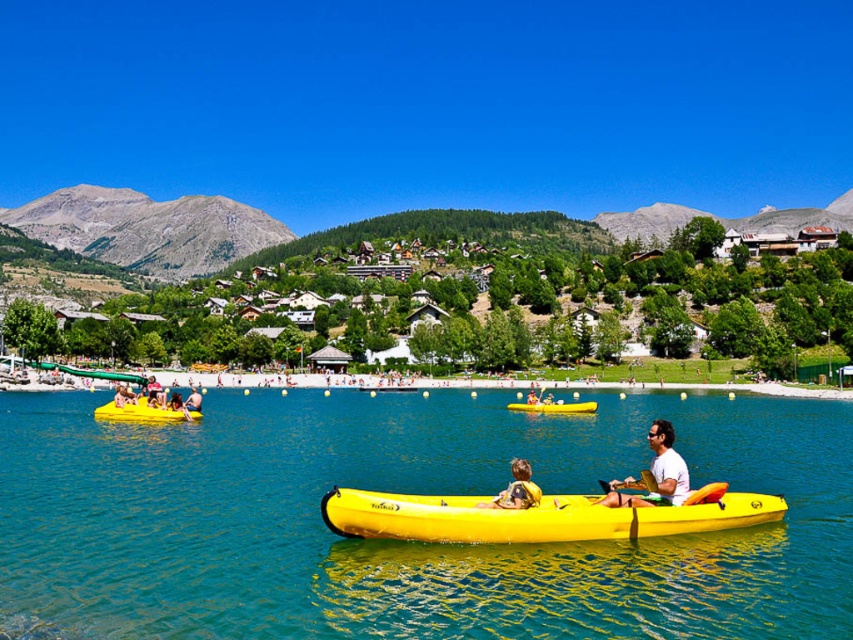
Question: Does yellow matte kayak at center appear on the right side of white matte kayak at center?

Choices:
 (A) no
 (B) yes

Answer: (A)

Question: Considering the real-world distances, which object is farthest from the yellow rubber canoe at center?

Choices:
 (A) yellow fabric life vest at lower center
 (B) yellow rubber boat at lower left
 (C) yellow rubber boat at center
 (D) yellow matte kayak at center

Answer: (B)

Question: Which point is farther to the camera?

Choices:
 (A) (666, 429)
 (B) (543, 408)
 (C) (519, 480)

Answer: (B)

Question: Can you confirm if white matte kayak at center is thinner than yellow fabric life vest at lower center?

Choices:
 (A) yes
 (B) no

Answer: (B)

Question: Does yellow matte kayak at center appear over yellow fabric life vest at lower center?

Choices:
 (A) no
 (B) yes

Answer: (A)

Question: Which of the following is the closest to the observer?

Choices:
 (A) yellow fabric life vest at lower center
 (B) yellow matte kayak at center
 (C) yellow rubber boat at center
 (D) yellow rubber boat at lower left

Answer: (C)